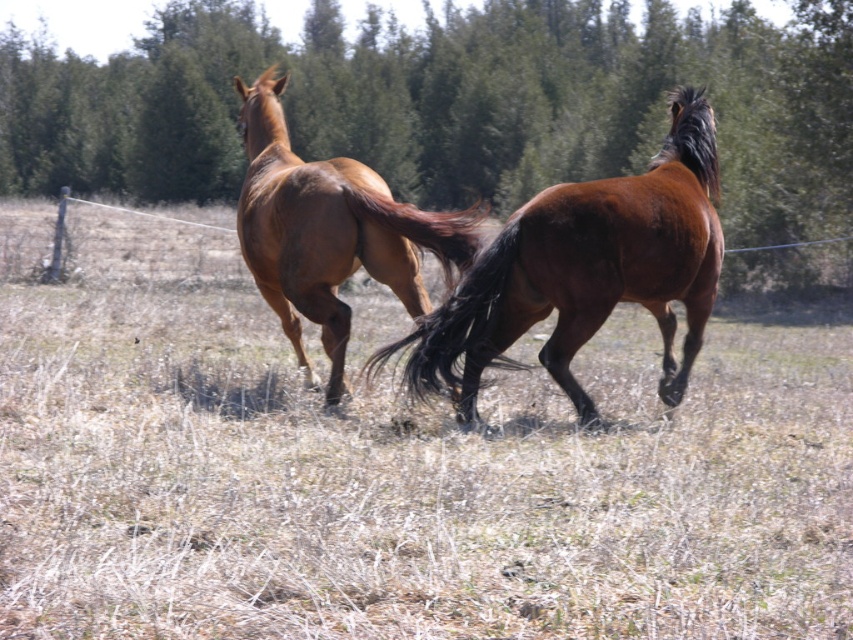
In the scene shown: You are a photographer trying to capture the horses in the scene. You want to ensure that both the brown dry grass at center and the green leafy tree at upper center are visible in your shot. Given their heights, which object will appear smaller in the photograph?

The brown dry grass at center has a lesser height compared to the green leafy tree at upper center, so the brown dry grass at center will appear smaller in the photograph.

You are standing at the point marked as point (x=554, y=298) in the image. You want to take a photo of the two horses using a camera that is 20 feet away from you. Is the camera close enough to capture the horses clearly?

The camera is 20.25 feet away from point (x=554, y=298), which is slightly further than the 20 feet required. Therefore, the camera might not be close enough to capture the horses clearly.

Looking at this image, you are a photographer standing at the edge of the field. You want to take a photo of the shiny brown horse at center and ensure the green leafy tree at upper center appears in the background. Can you position yourself so that both are in the same frame without moving the horse or the tree?

The green leafy tree at upper center is 8.77 meters away from the shiny brown horse at center. Since the distance between them is manageable for a camera lens, you can position yourself between them or at an angle where both fit within the frame.